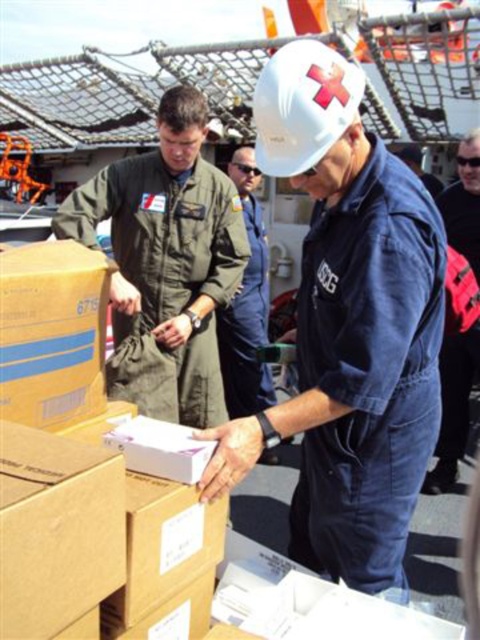
Question: Is white hard hat at center further to camera compared to cardboard box at lower left?

Choices:
 (A) no
 (B) yes

Answer: (B)

Question: Which point is closer to the camera?

Choices:
 (A) green fabric uniform at center
 (B) blue denim jumpsuit at center
 (C) cardboard box at lower left
 (D) denim jacket at lower right

Answer: (C)

Question: Which of the following is the farthest from the observer?

Choices:
 (A) yellow cardboard box at lower left
 (B) cardboard box at lower left
 (C) blue denim jumpsuit at center
 (D) denim jacket at lower right

Answer: (C)

Question: Where is green fabric uniform at center located in relation to blue denim jumpsuit at center in the image?

Choices:
 (A) below
 (B) above

Answer: (A)

Question: Can you confirm if white hard hat at center is bigger than blue denim jumpsuit at center?

Choices:
 (A) yes
 (B) no

Answer: (A)

Question: Which point is closer to the camera?

Choices:
 (A) white hard hat at center
 (B) cardboard box at lower left
 (C) yellow cardboard box at lower left
 (D) blue denim jumpsuit at center

Answer: (B)